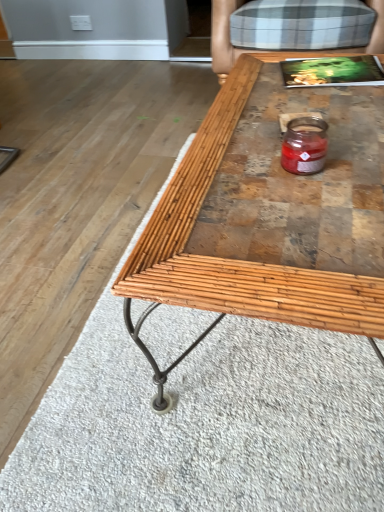
At what (x,y) coordinates should I click in order to perform the action: click on free space in front of translucent glass candle at center. Please return your answer as a coordinate pair (x, y). This screenshot has height=512, width=384. Looking at the image, I should click on (321, 206).